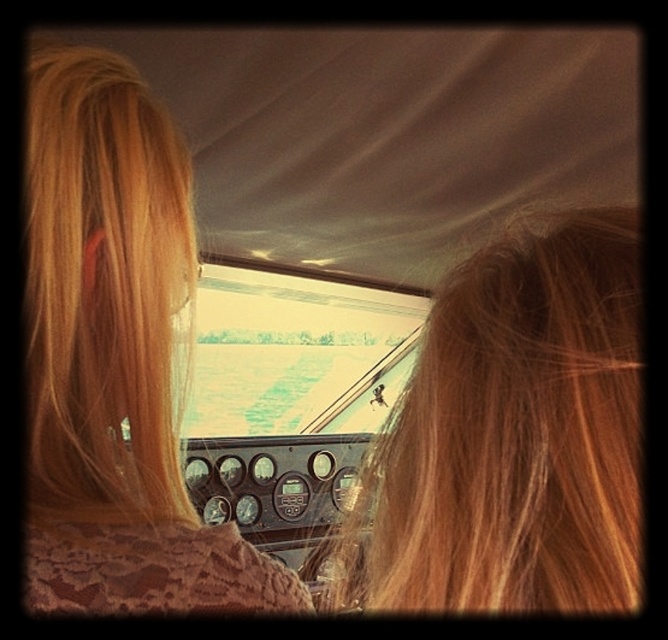
Question: Does blonde hair at center have a smaller size compared to blonde hair at left?

Choices:
 (A) no
 (B) yes

Answer: (B)

Question: Is blonde hair at center positioned behind blonde hair at left?

Choices:
 (A) no
 (B) yes

Answer: (A)

Question: Is blonde hair at center positioned in front of blonde hair at left?

Choices:
 (A) yes
 (B) no

Answer: (A)

Question: Which point is farther to the camera?

Choices:
 (A) blonde hair at center
 (B) blonde hair at left

Answer: (B)